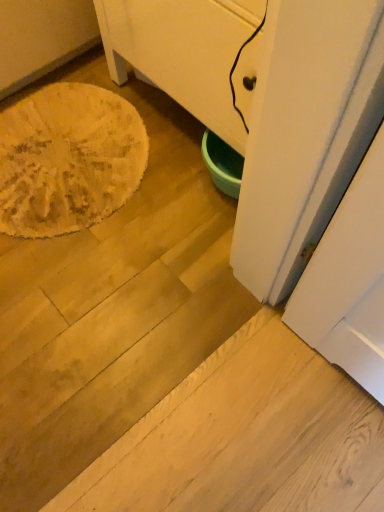
Measure the distance between point (365, 125) and camera.

Point (365, 125) is 21.97 inches away from camera.

This screenshot has height=512, width=384. Describe the element at coordinates (266, 106) in the screenshot. I see `green plastic bowl at lower center` at that location.

At what (x,y) coordinates should I click in order to perform the action: click on green plastic bowl at lower center. Please return your answer as a coordinate pair (x, y). The height and width of the screenshot is (512, 384). Looking at the image, I should click on (266, 106).

Where is `green plastic bowl at lower center`? Image resolution: width=384 pixels, height=512 pixels. green plastic bowl at lower center is located at coordinates (266, 106).